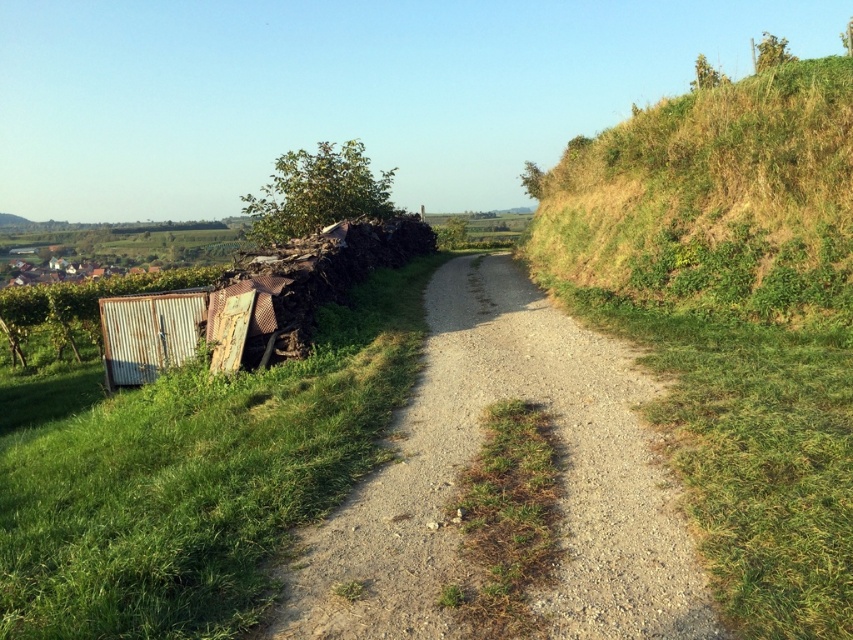
You are a hiker trying to cross the gravelly dirt path at center. There is a green corrugated metal at left nearby. Which direction should you move to reach the path from the metal?

To reach the gravelly dirt path at center from the green corrugated metal at left, you should move to the right since the green corrugated metal at left is located to the left of the path.

You are a hiker trying to decide whether to take the narrow dirt path. You notice the green corrugated metal at left and the green grassy hillside at upper right. Which of these two objects is shorter in height?

The green corrugated metal at left is shorter in height compared to the green grassy hillside at upper right.

You are a hiker standing at the start of the narrow dirt path. You want to reach the green grassy hillside at upper right. Which direction should you head relative to the green corrugated metal at left?

You should head to the right of the green corrugated metal at left because the green grassy hillside at upper right is located to the right of it.